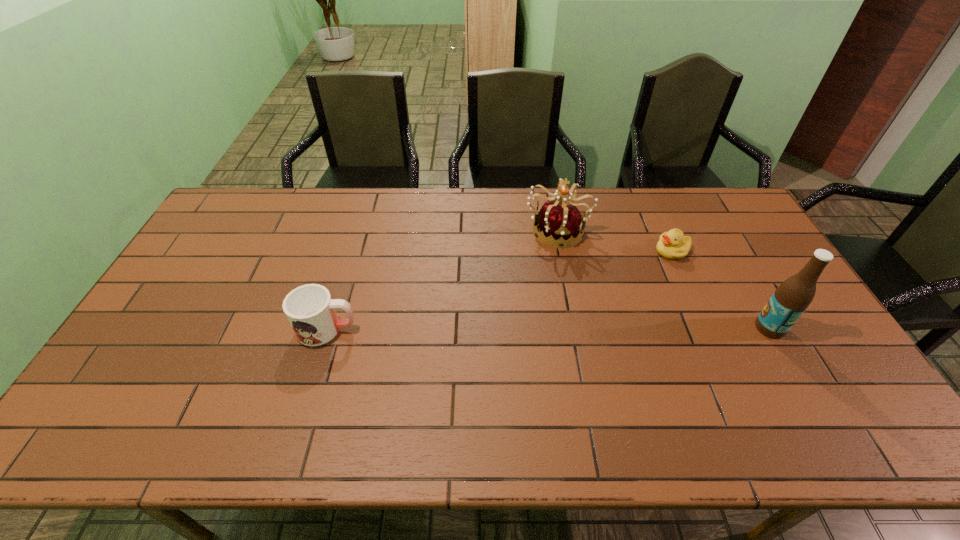
Find the location of `vacant space on the desktop that is between the mug and the rightmost object and is positioned on the front-facing side of the tiara`. vacant space on the desktop that is between the mug and the rightmost object and is positioned on the front-facing side of the tiara is located at coordinates (567, 328).

This screenshot has height=540, width=960. Identify the location of free spot on the desktop that is between the mug and the tallest object and is positioned on the front-facing side of the third object from left to right. 559,328.